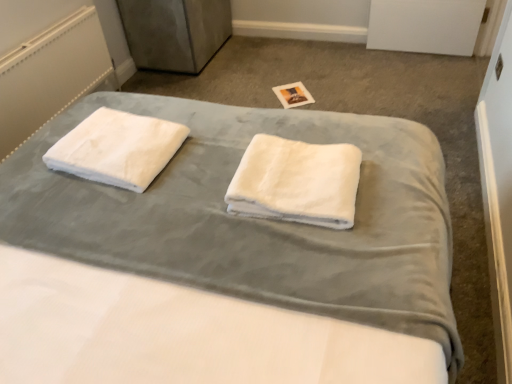
Question: Should I look upward or downward to see white soft towels at center?

Choices:
 (A) down
 (B) up

Answer: (B)

Question: Considering the relative sizes of white soft towel at left, which is the 2th towel from right to left, and white fabric radiator at upper left in the image provided, is white soft towel at left, which is the 2th towel from right to left, taller than white fabric radiator at upper left?

Choices:
 (A) no
 (B) yes

Answer: (A)

Question: Considering the relative sizes of white soft towel at left, which is the 2th towel from right to left, and white fabric radiator at upper left in the image provided, is white soft towel at left, which is the 2th towel from right to left, thinner than white fabric radiator at upper left?

Choices:
 (A) no
 (B) yes

Answer: (A)

Question: Is white soft towel at left, which is the 2th towel from right to left, turned away from white fabric radiator at upper left?

Choices:
 (A) yes
 (B) no

Answer: (B)

Question: Can white fabric radiator at upper left be found inside white soft towel at left, which is the 2th towel from right to left?

Choices:
 (A) no
 (B) yes

Answer: (A)

Question: Can you confirm if white soft towel at left, the 1th towel viewed from the left, is wider than white fabric radiator at upper left?

Choices:
 (A) no
 (B) yes

Answer: (B)

Question: Is white soft towel at left, which is the 2th towel from right to left, next to white fabric radiator at upper left and touching it?

Choices:
 (A) no
 (B) yes

Answer: (A)

Question: From the image's perspective, is white soft towels at center over white soft towel at left, the 1th towel viewed from the left?

Choices:
 (A) yes
 (B) no

Answer: (B)

Question: Is white soft towels at center further to the viewer compared to white soft towel at left, the 1th towel viewed from the left?

Choices:
 (A) yes
 (B) no

Answer: (B)

Question: Can you confirm if white soft towels at center is smaller than white soft towel at left, which is the 2th towel from right to left?

Choices:
 (A) yes
 (B) no

Answer: (B)

Question: Does white soft towels at center appear on the right side of white soft towel at left, the 1th towel viewed from the left?

Choices:
 (A) yes
 (B) no

Answer: (A)

Question: Is the position of white soft towels at center less distant than that of white soft towel at left, which is the 2th towel from right to left?

Choices:
 (A) no
 (B) yes

Answer: (B)

Question: From the image's perspective, is white soft towels at center under white soft towel at left, the 1th towel viewed from the left?

Choices:
 (A) yes
 (B) no

Answer: (A)

Question: Is the surface of white soft towel at left, the 1th towel viewed from the left, in direct contact with white soft towels at center?

Choices:
 (A) no
 (B) yes

Answer: (A)